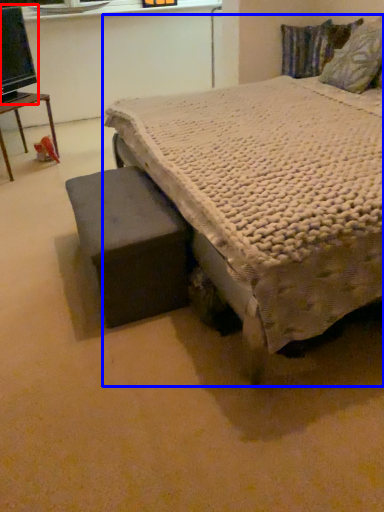
Question: Which object is closer to the camera taking this photo, computer monitor (highlighted by a red box) or bed (highlighted by a blue box)?

Choices:
 (A) computer monitor
 (B) bed

Answer: (B)